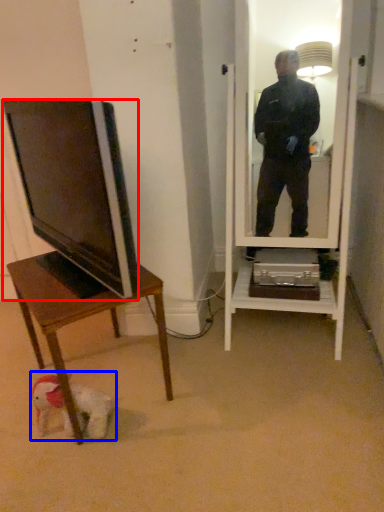
Question: Which point is further to the camera, television (highlighted by a red box) or dog (highlighted by a blue box)?

Choices:
 (A) television
 (B) dog

Answer: (B)